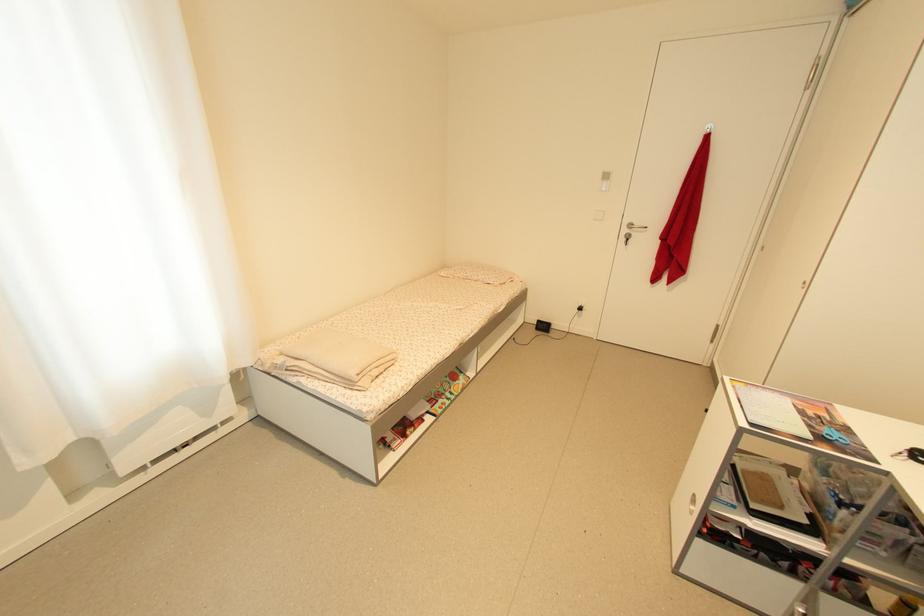
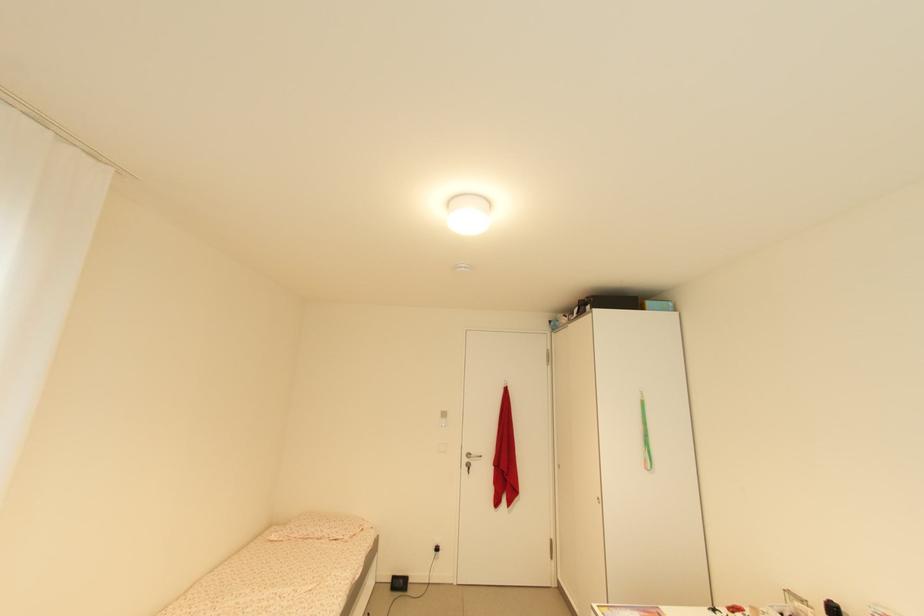
The point at (x=630, y=233) is marked in the first image. Where is the corresponding point in the second image?

(470, 461)